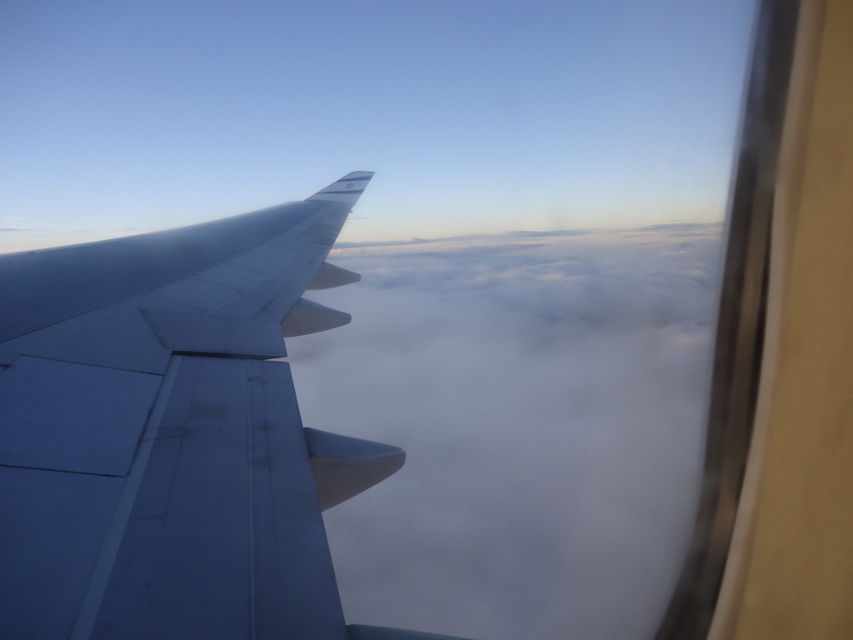
Question: Among these points, which one is nearest to the camera?

Choices:
 (A) (65, 563)
 (B) (679, 342)

Answer: (A)

Question: Among these points, which one is farthest from the camera?

Choices:
 (A) (7, 397)
 (B) (456, 288)

Answer: (B)

Question: Can you confirm if white fluffy cloud at center is wider than matte gray wing at left?

Choices:
 (A) no
 (B) yes

Answer: (B)

Question: Can you confirm if white fluffy cloud at center is wider than matte gray wing at left?

Choices:
 (A) yes
 (B) no

Answer: (A)

Question: Does white fluffy cloud at center appear on the left side of matte gray wing at left?

Choices:
 (A) no
 (B) yes

Answer: (A)